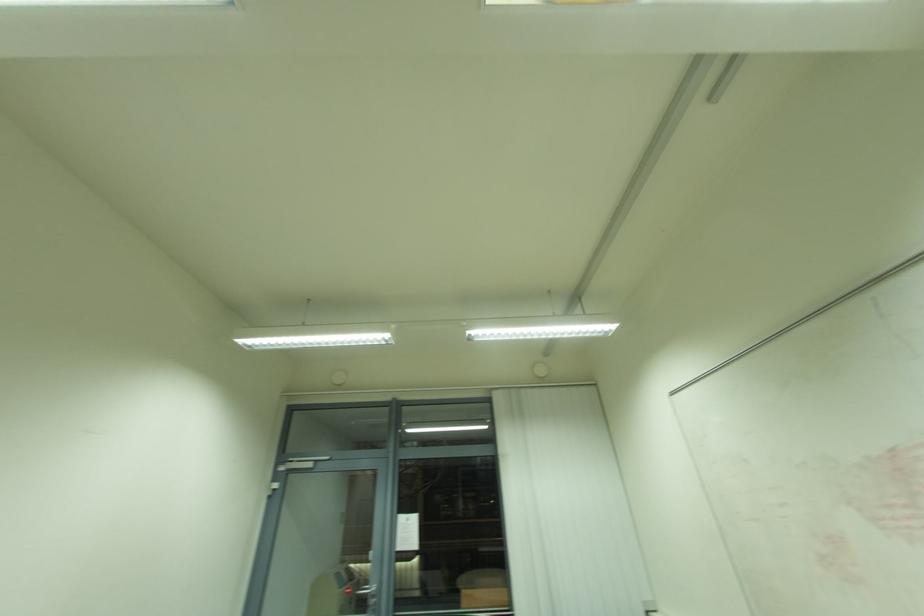
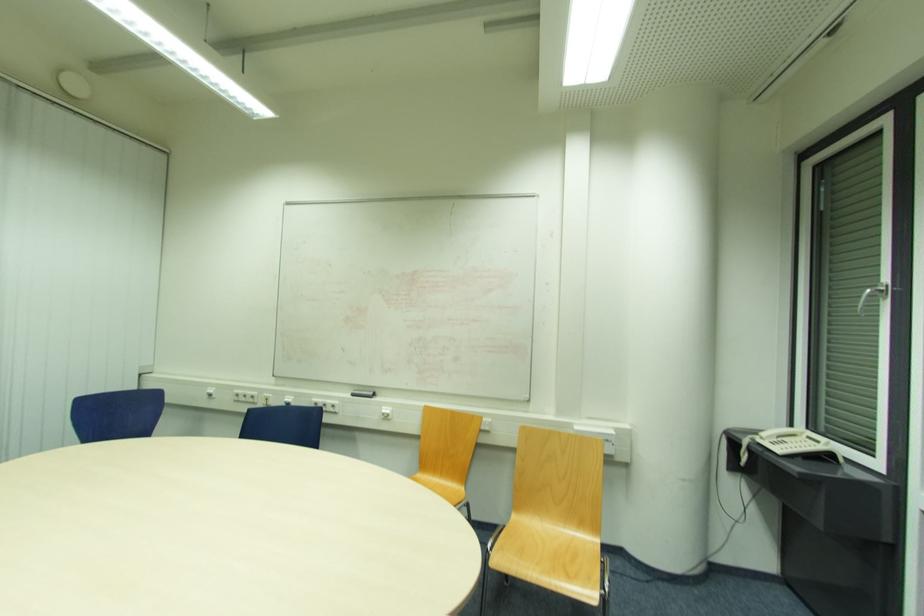
Question: Based on the continuous images, in which direction is the camera rotating? Reply with the corresponding letter.

Choices:
 (A) Left
 (B) Right
 (C) Up
 (D) Down

Answer: (B)